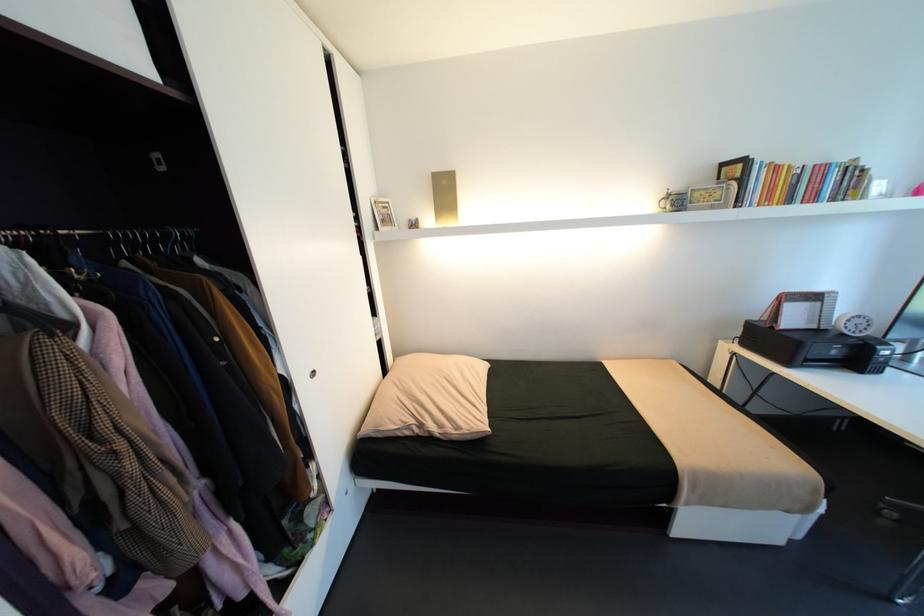
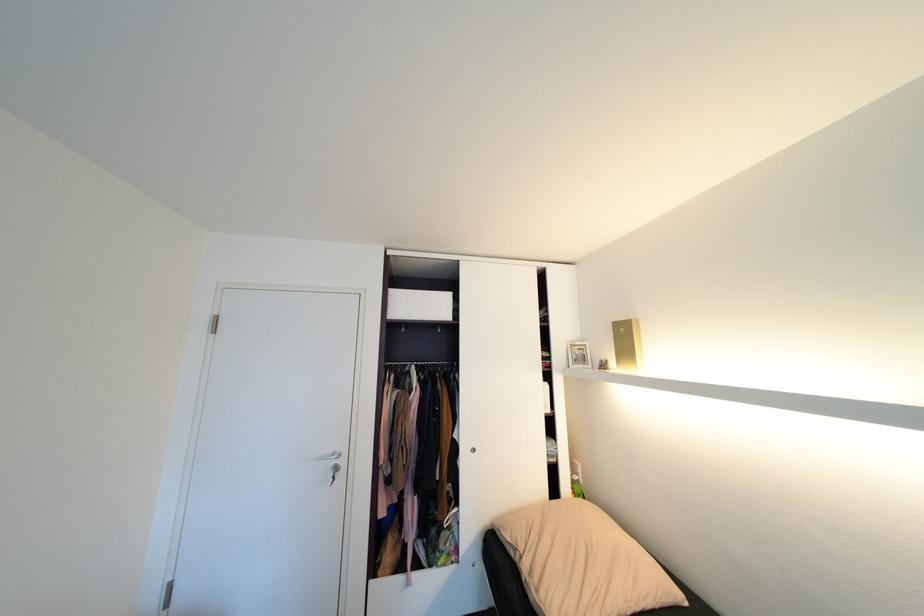
Where in the second image is the point corresponding to [321,373] from the first image?

(481, 450)